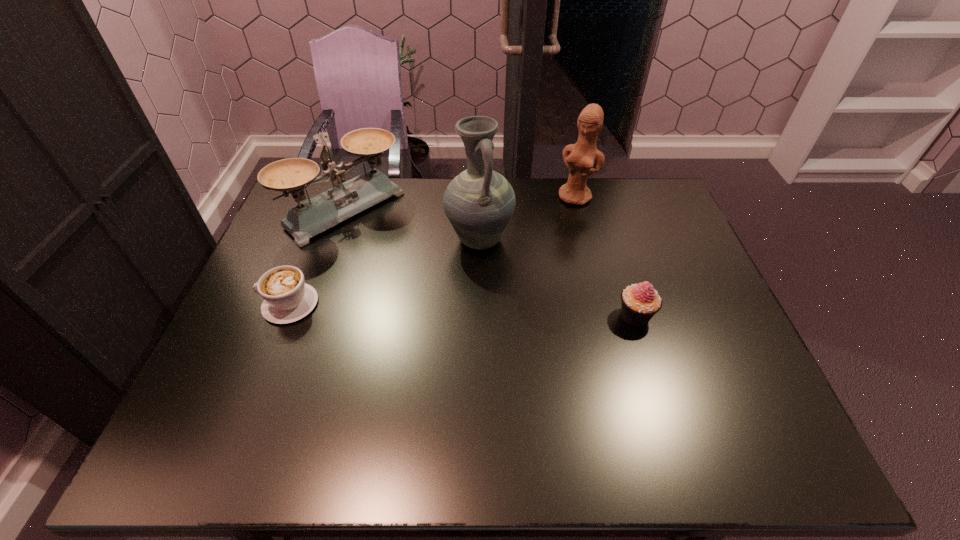
You are a GUI agent. You are given a task and a screenshot of the screen. Output one action in this format:
    pyautogui.click(x=<x>, y=<y>)
    Task: Click on the free space on the desktop that is between the cappuccino and the cupcake and is positioned on the front-facing side of the scale
    Image resolution: width=960 pixels, height=540 pixels.
    Given the screenshot: What is the action you would take?
    pyautogui.click(x=474, y=310)

The image size is (960, 540). Identify the location of vacant space on the desktop that is between the cappuccino and the second shortest object and is positioned on the handle side of the third object from right to left. (468, 310).

The width and height of the screenshot is (960, 540). I want to click on vacant space on the desktop that is between the cappuccino and the cupcake and is positioned on the front-facing side of the figurine, so click(x=512, y=312).